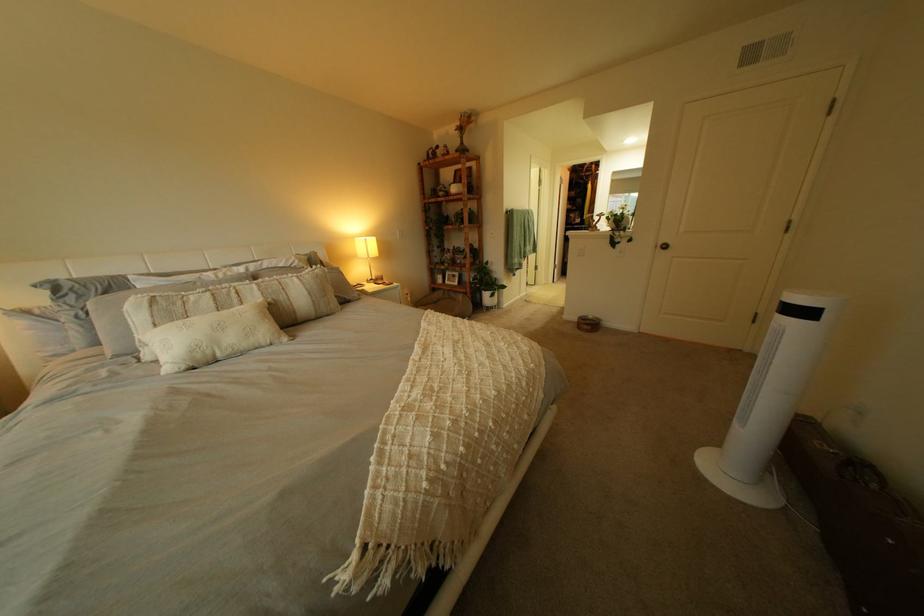
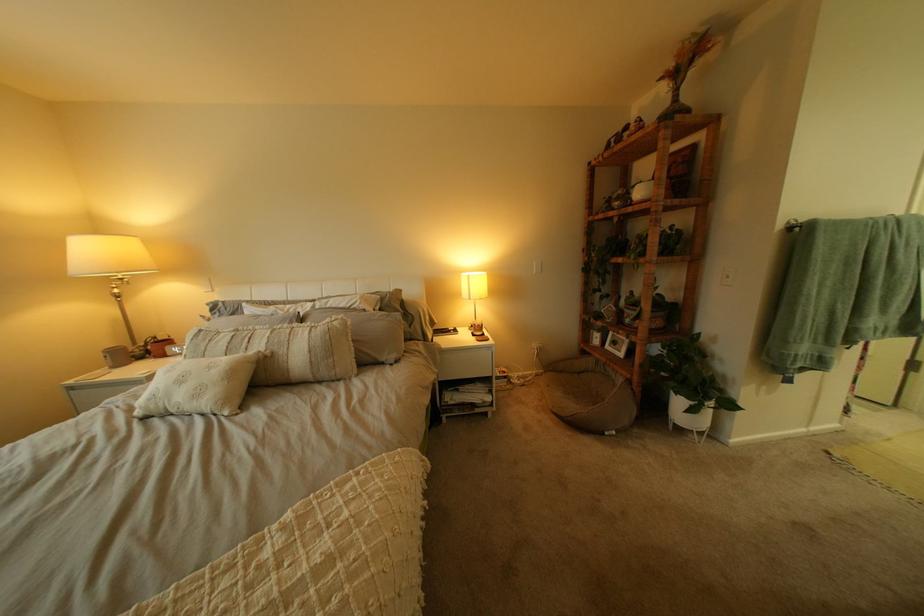
Find the pixel in the second image that matches (x=274, y=294) in the first image.

(281, 342)